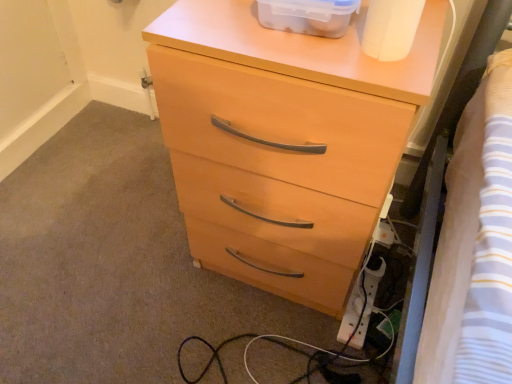
Question: Is white matte toilet paper at upper right in front of or behind matte wood chest of drawers at center in the image?

Choices:
 (A) behind
 (B) front

Answer: (B)

Question: Looking at the image, does white matte toilet paper at upper right seem bigger or smaller compared to matte wood chest of drawers at center?

Choices:
 (A) big
 (B) small

Answer: (B)

Question: Estimate the real-world distances between objects in this image. Which object is closer to the white matte toilet paper at upper right?

Choices:
 (A) translucent plastic container at upper center
 (B) white plastic extension cord at lower right
 (C) matte wood chest of drawers at center

Answer: (A)

Question: Estimate the real-world distances between objects in this image. Which object is closer to the white plastic extension cord at lower right?

Choices:
 (A) translucent plastic container at upper center
 (B) matte wood chest of drawers at center
 (C) white matte toilet paper at upper right

Answer: (B)